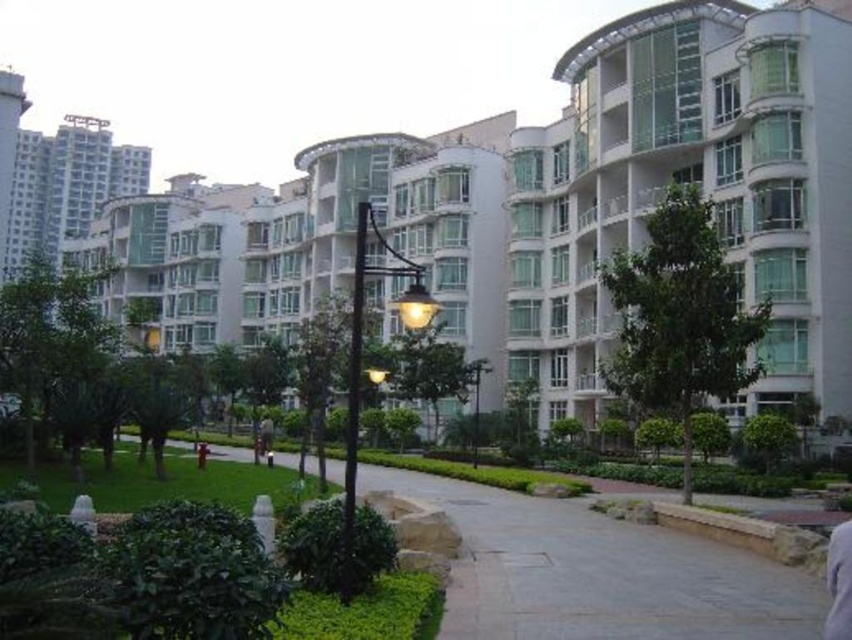
You are standing on the smooth concrete path at center and looking towards the gray fabric shirt at lower right. Which object is closer to the ground?

The smooth concrete path at center is closer to the ground because it is below the gray fabric shirt at lower right.

You are a drone operator tasked with capturing aerial footage of the white glossy building at center and the white glass condominium at upper center. Based on their heights, which one should you prioritize filming first if you want to capture both structures in a single continuous shot without adjusting the camera angle?

The white glossy building at center is taller than the white glass condominium at upper center, so you should prioritize filming the white glossy building at center first to ensure both structures are captured in the frame before adjusting the camera angle.

You are a delivery person approaching the white glossy building at center and the gray fabric shirt at lower right. Which object is closer to you as you walk towards the buildings?

The gray fabric shirt at lower right is behind the white glossy building at center, so the white glossy building at center is closer to you.